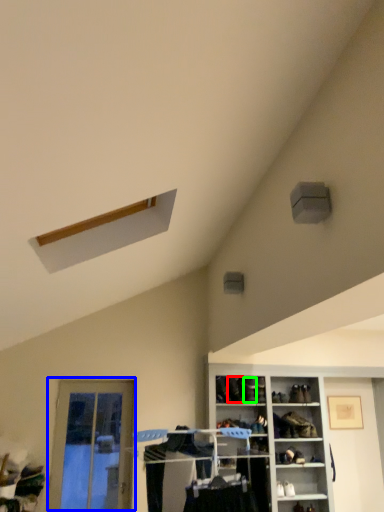
Question: Considering the real-world distances, which object is closest to shoe (highlighted by a red box)? door (highlighted by a blue box) or shoe (highlighted by a green box).

Choices:
 (A) door
 (B) shoe

Answer: (B)